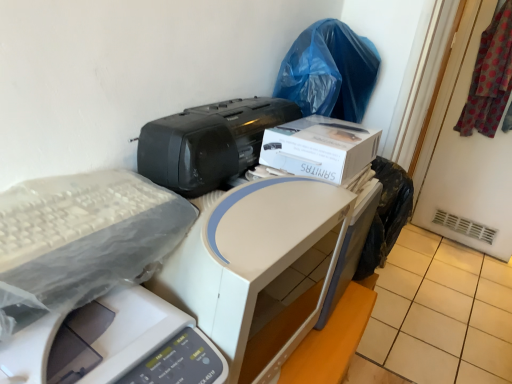
Question: Based on their sizes in the image, would you say white plastic printer at center, acting as the third printer starting from the top, is bigger or smaller than beige tile at lower right?

Choices:
 (A) big
 (B) small

Answer: (B)

Question: From the image's perspective, is white plastic printer at center, which is the 1th printer in bottom-to-top order, located above or below beige tile at lower right?

Choices:
 (A) above
 (B) below

Answer: (A)

Question: Which object is the closest to the beige tile at lower right?

Choices:
 (A) blue plastic bag at upper right
 (B) white plastic printer at center, acting as the third printer starting from the top
 (C) polka dot fabric at upper right
 (D) black plastic printer at center, arranged as the third printer when ordered from the bottom
 (E) white plastic printer at center, acting as the 2th printer starting from the bottom

Answer: (C)

Question: Which is nearer to the beige tile at lower right?

Choices:
 (A) white plastic printer at center, acting as the third printer starting from the top
 (B) white cardboard box at upper center
 (C) polka dot fabric at upper right
 (D) blue plastic bag at upper right
 (E) white plastic printer at center, which is the 2th printer in top-to-bottom order

Answer: (C)